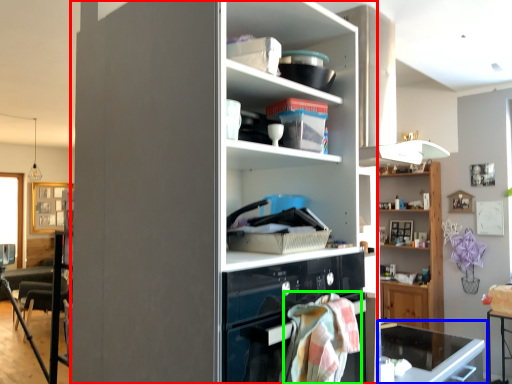
Question: Which is farther away from cupboard (highlighted by a red box)? desk (highlighted by a blue box) or blanket (highlighted by a green box)?

Choices:
 (A) desk
 (B) blanket

Answer: (A)